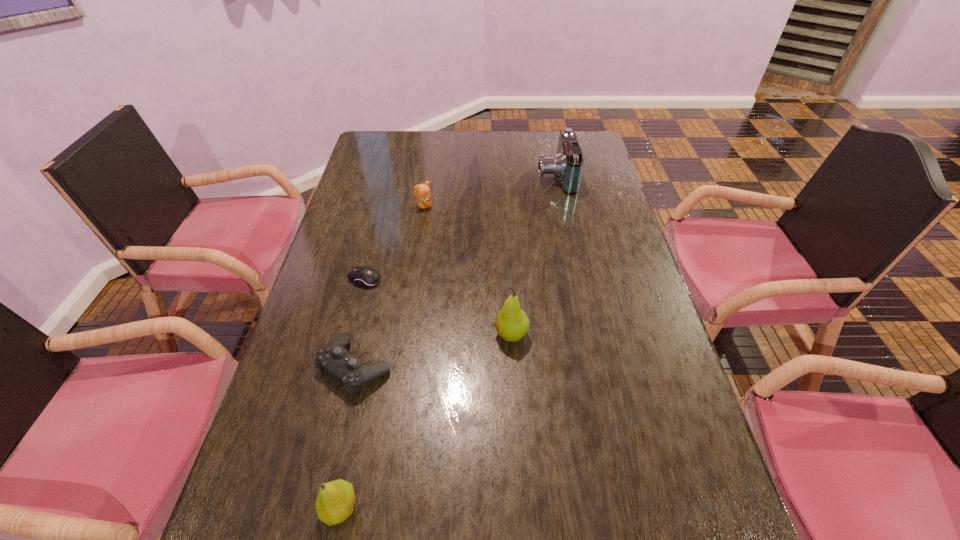
The pears are evenly distributed in the image. To maintain this, where would you place another pear on the right? Please point to a free space. Please provide its 2D coordinates. Your answer should be formatted as a tuple, i.e. [(x, y)], where the tuple contains the x and y coordinates of a point satisfying the conditions above.

[(613, 230)]